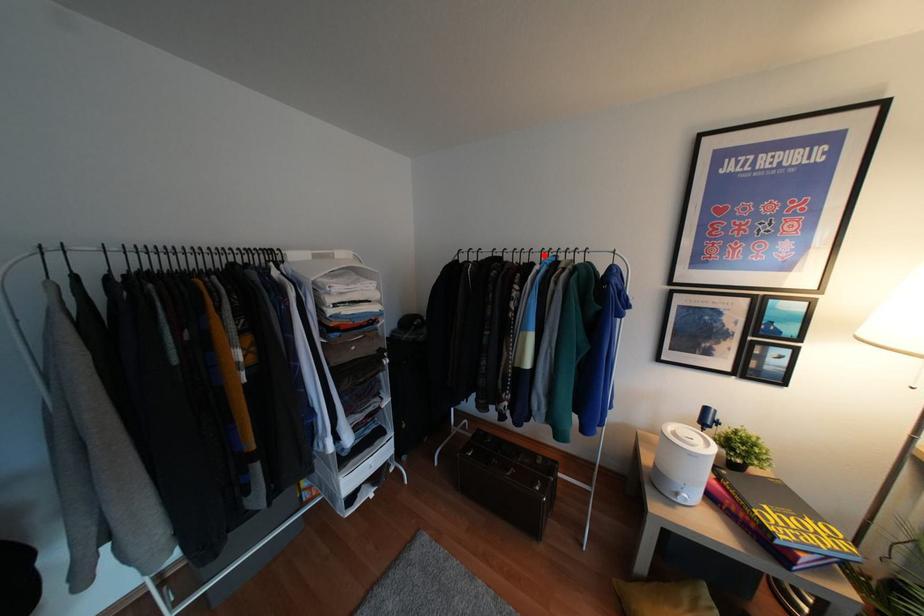
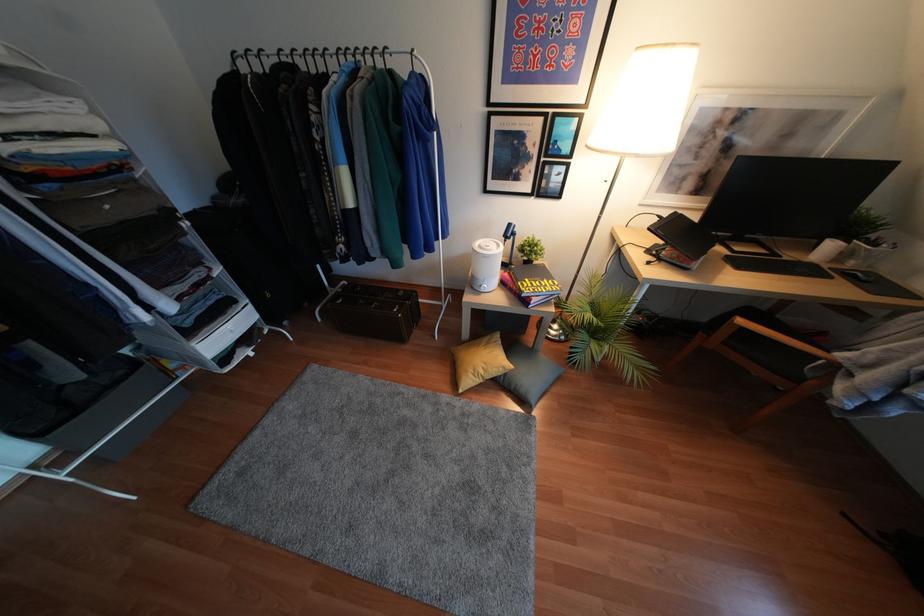
Find the pixel in the second image that matches the highlighted location in the first image.

(342, 59)